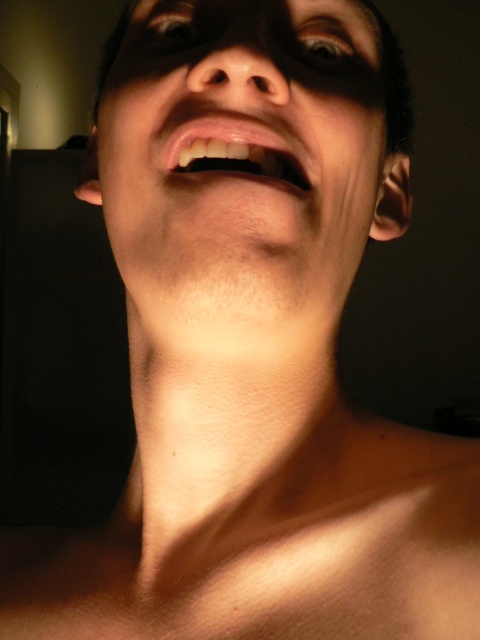
Is smooth skin face at center taller than brown matte eye at upper center?

Yes.

Locate an element on the screen. This screenshot has height=640, width=480. smooth skin face at center is located at coordinates (240, 173).

Is point (268, 3) more distant than point (152, 19)?

No, it is not.

The height and width of the screenshot is (640, 480). I want to click on smooth skin face at center, so click(x=240, y=173).

Who is lower down, smooth skin face at center or smooth skin mouth at center?

Positioned lower is smooth skin mouth at center.

Is smooth skin face at center below smooth skin mouth at center?

No.

I want to click on smooth skin face at center, so click(240, 173).

Who is lower down, brown matte eye at upper center or shiny blue eye at upper center?

shiny blue eye at upper center is lower down.

Does point (151, 12) come farther from viewer compared to point (326, 29)?

Yes, point (151, 12) is behind point (326, 29).

The height and width of the screenshot is (640, 480). I want to click on brown matte eye at upper center, so click(169, 22).